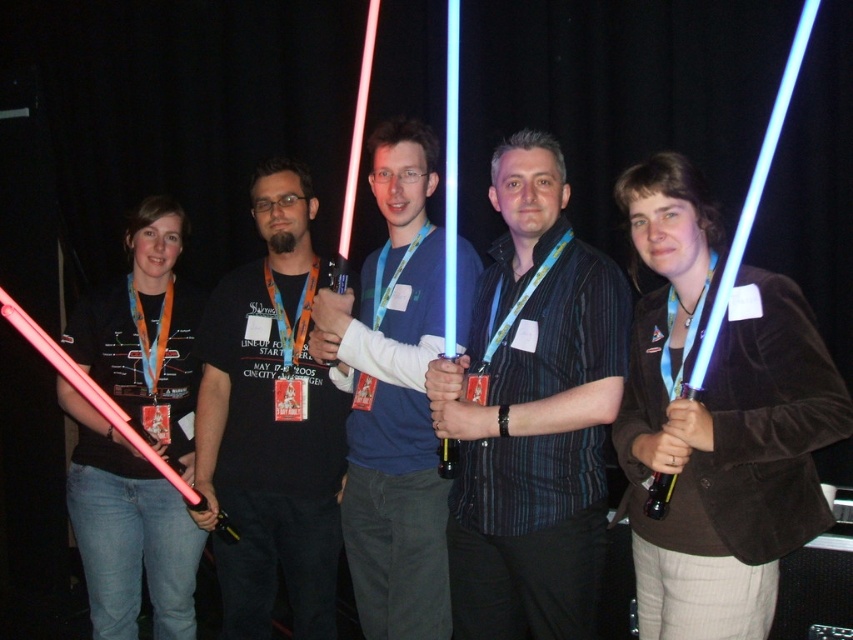
Question: Which object is positioned farthest from the matte plastic lightsaber at center?

Choices:
 (A) matte black t-shirt at center
 (B) shiny blue light saber at center

Answer: (A)

Question: Is shiny blue light saber at center wider than matte black t-shirt at center?

Choices:
 (A) yes
 (B) no

Answer: (A)

Question: Which point is closer to the camera?

Choices:
 (A) (476, 483)
 (B) (428, 522)

Answer: (A)

Question: Does shiny blue light saber at center have a smaller size compared to matte plastic lightsaber at center?

Choices:
 (A) yes
 (B) no

Answer: (A)

Question: Considering the real-world distances, which object is closest to the matte black t-shirt at center?

Choices:
 (A) shiny blue light saber at center
 (B) matte plastic lightsaber at center

Answer: (B)

Question: Is matte black t-shirt at center wider than matte plastic lightsaber at center?

Choices:
 (A) no
 (B) yes

Answer: (B)